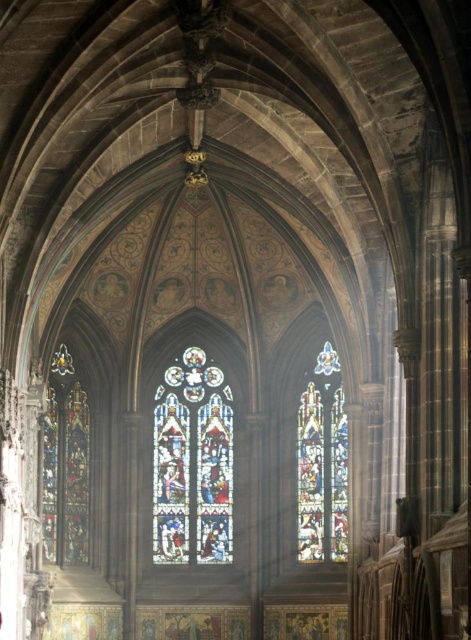
You are standing at the entrance of the cathedral, which is at the bottom of the image. Looking up, you notice the stained glass window at center. Based on its position, can you determine if it is closer to the left or right side of the cathedral?

The stained glass window at center is located at point 0.722 on the horizontal axis, which means it is closer to the right side of the cathedral since 0.722 is more than halfway between 0 and 1.